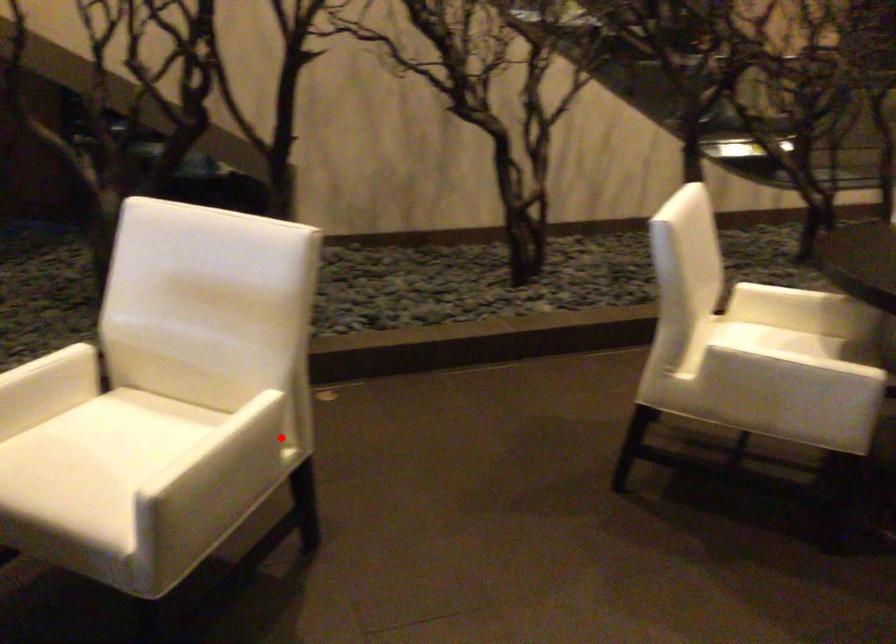
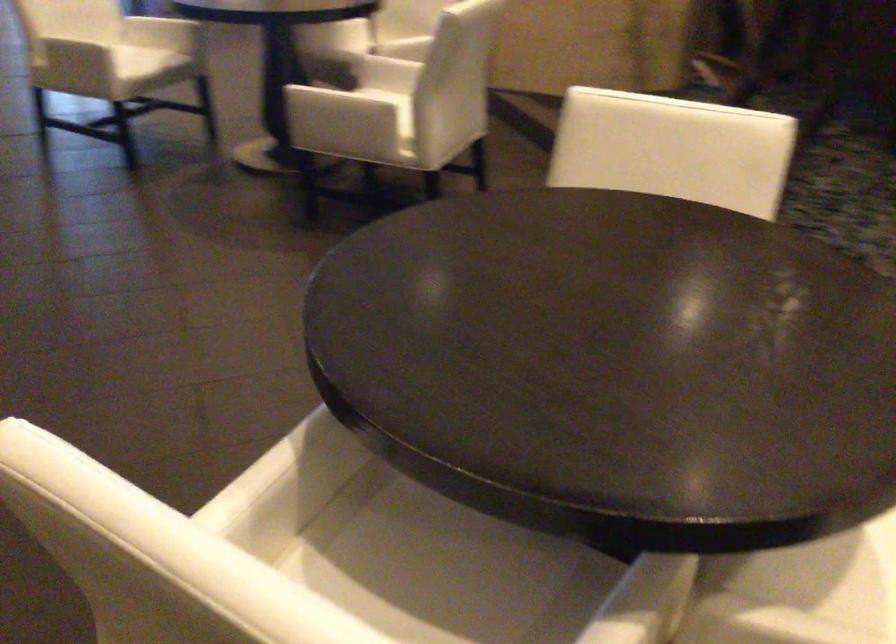
Find the pixel in the second image that matches the highlighted location in the first image.

(371, 109)